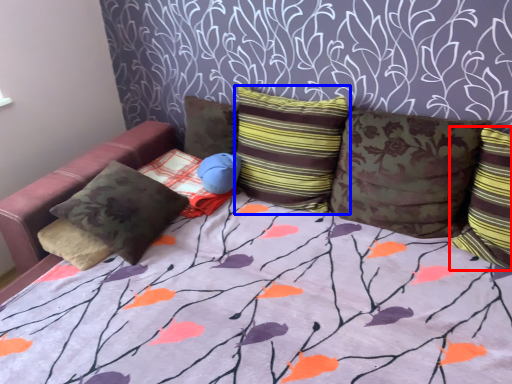
Question: Which object is further to the camera taking this photo, pillow (highlighted by a red box) or pillow (highlighted by a blue box)?

Choices:
 (A) pillow
 (B) pillow

Answer: (B)